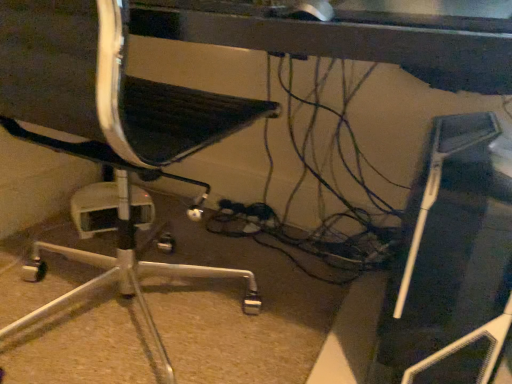
The height and width of the screenshot is (384, 512). Find the location of `matte black chair at center`. matte black chair at center is located at coordinates (106, 120).

What do you see at coordinates (106, 120) in the screenshot?
I see `matte black chair at center` at bounding box center [106, 120].

In the scene shown: In order to face matte black chair at center, should I rotate leftwards or rightwards?

You should rotate left by 2.967 degrees.

Where is `matte black chair at center`? matte black chair at center is located at coordinates (106, 120).